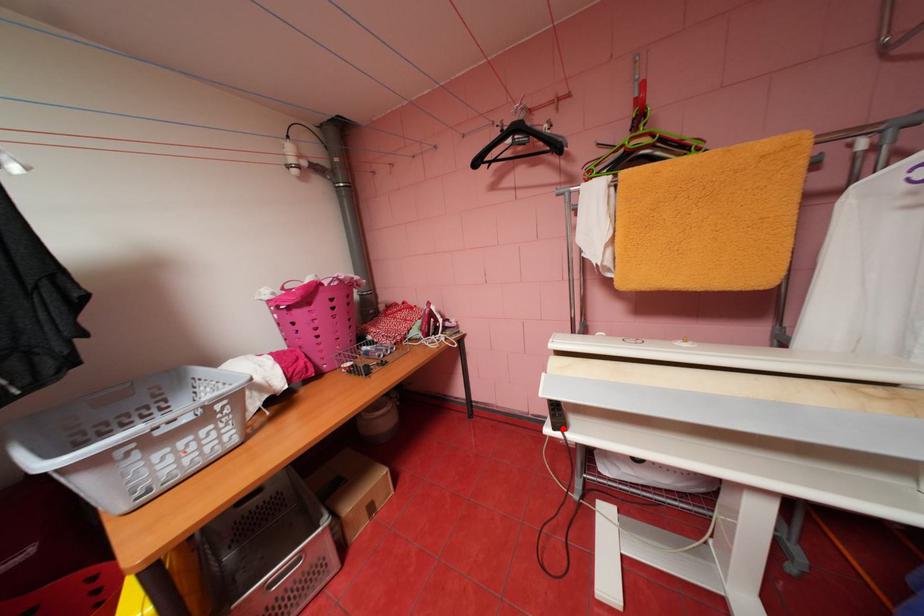
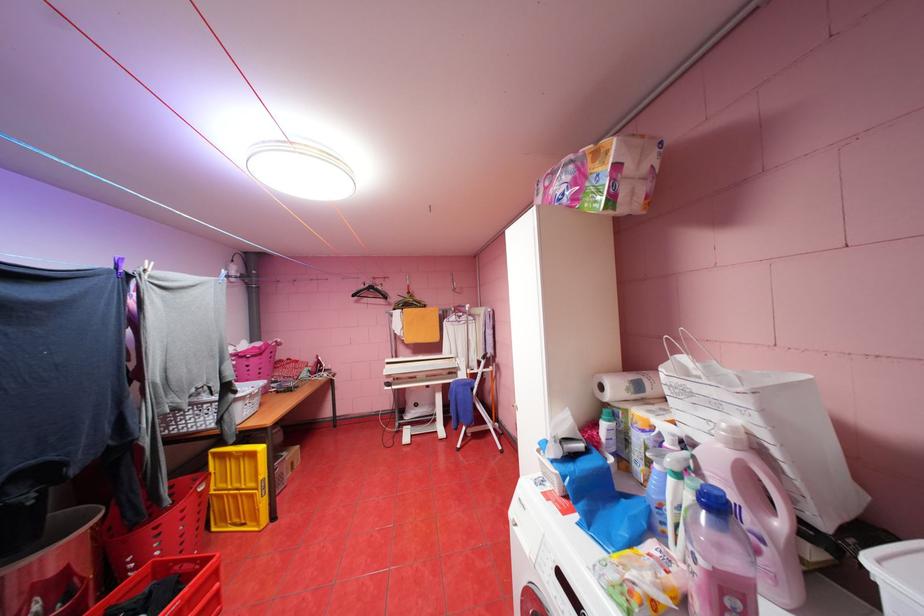
Question: I am providing you with two images of the same scene from different viewpoints. A red point is marked on the first image. Can you still see the location of the red point in image 2?

Choices:
 (A) Yes
 (B) No

Answer: (A)